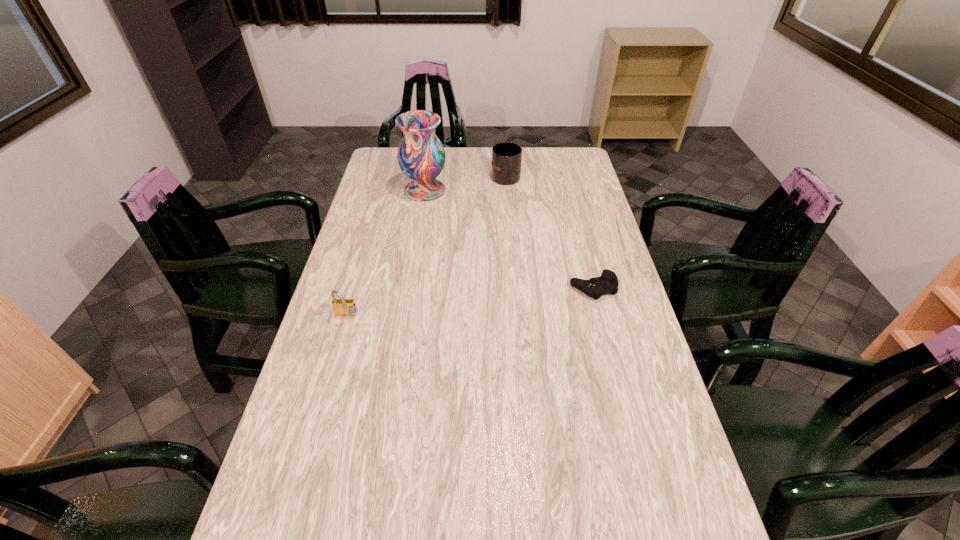
This screenshot has height=540, width=960. Identify the location of the tallest object. 421,156.

Locate an element on the screen. The image size is (960, 540). vase is located at coordinates (421, 156).

Where is `mug`? The image size is (960, 540). mug is located at coordinates (506, 161).

Locate an element on the screen. the second tallest object is located at coordinates (506, 161).

At what (x,y) coordinates should I click in order to perform the action: click on padlock. Please return your answer as a coordinate pair (x, y). This screenshot has height=540, width=960. Looking at the image, I should click on (343, 307).

The height and width of the screenshot is (540, 960). What are the coordinates of `the third tallest object` in the screenshot? It's located at (343, 307).

Identify the location of control. (607, 283).

Find the location of a particular element. This screenshot has width=960, height=540. the third farthest object is located at coordinates (607, 283).

At what (x,y) coordinates should I click in order to perform the action: click on vacant space located on the back of the third object from right to left. Please return your answer as a coordinate pair (x, y). The height and width of the screenshot is (540, 960). Looking at the image, I should click on (429, 165).

The image size is (960, 540). Identify the location of free space located with the handle on the side of the second object from right to left. (504, 157).